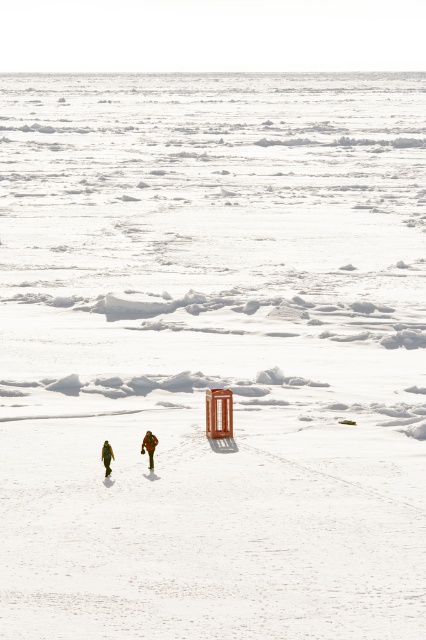
Question: Can you confirm if orange fabric jacket at center is thinner than green matte jacket at lower center?

Choices:
 (A) no
 (B) yes

Answer: (A)

Question: Can you confirm if orange fabric jacket at center is smaller than green matte jacket at lower center?

Choices:
 (A) no
 (B) yes

Answer: (A)

Question: Which object appears closest to the camera in this image?

Choices:
 (A) green matte jacket at lower center
 (B) orange fabric jacket at center

Answer: (A)

Question: Does orange fabric jacket at center appear over green matte jacket at lower center?

Choices:
 (A) yes
 (B) no

Answer: (A)